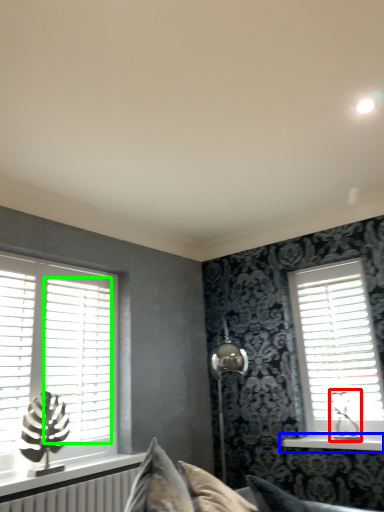
Question: Considering the real-world distances, which object is closest to table lamp (highlighted by a red box)? window sill (highlighted by a blue box) or blind (highlighted by a green box).

Choices:
 (A) window sill
 (B) blind

Answer: (A)